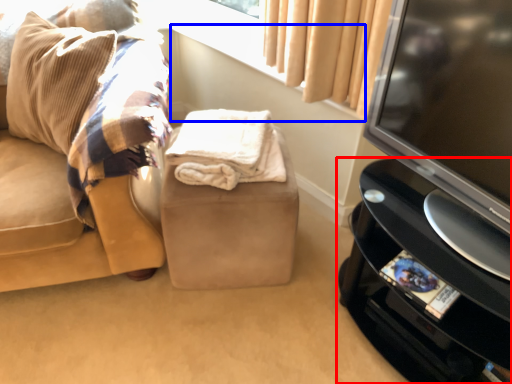
Question: Among these objects, which one is nearest to the camera, furniture (highlighted by a red box) or window sill (highlighted by a blue box)?

Choices:
 (A) furniture
 (B) window sill

Answer: (A)